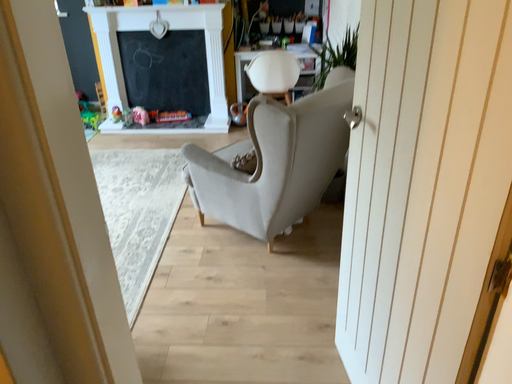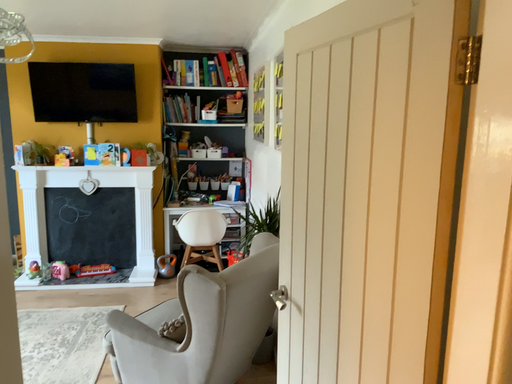
Question: How did the camera likely rotate when shooting the video?

Choices:
 (A) rotated right
 (B) rotated left

Answer: (A)